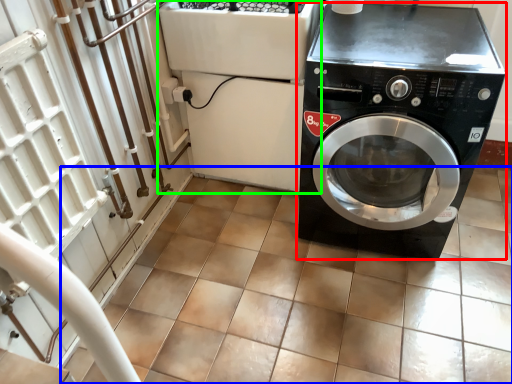
Question: Considering the real-world distances, which object is farthest from washing machine (highlighted by a red box)? tile (highlighted by a blue box) or appliance (highlighted by a green box)?

Choices:
 (A) tile
 (B) appliance

Answer: (A)